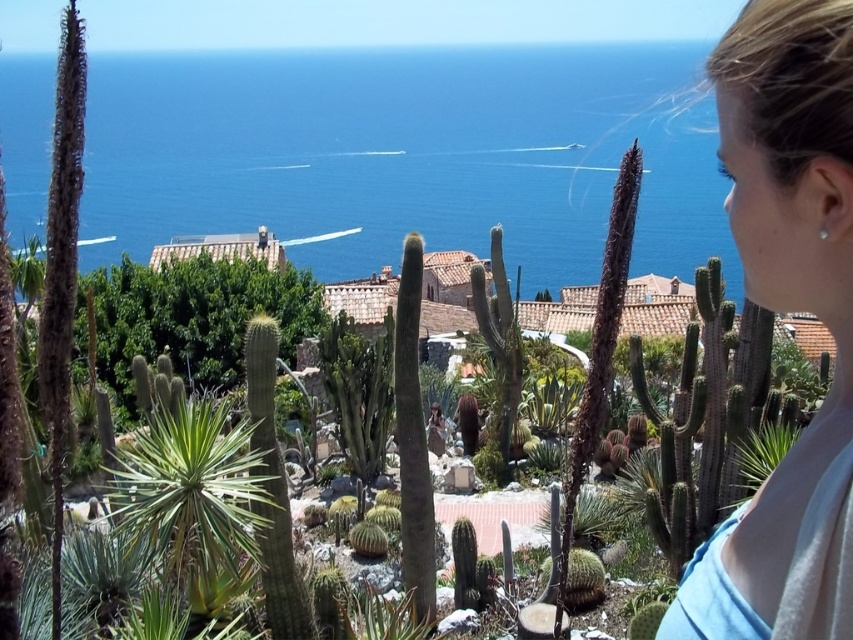
Is point (257, 124) farther from viewer compared to point (749, 67)?

Yes, point (257, 124) is farther from viewer.

Is blue water at center positioned in front of blonde hair at upper right?

No.

Describe the element at coordinates (407, 156) in the screenshot. I see `blue water at center` at that location.

At what (x,y) coordinates should I click in order to perform the action: click on blue water at center. Please return your answer as a coordinate pair (x, y). Looking at the image, I should click on (407, 156).